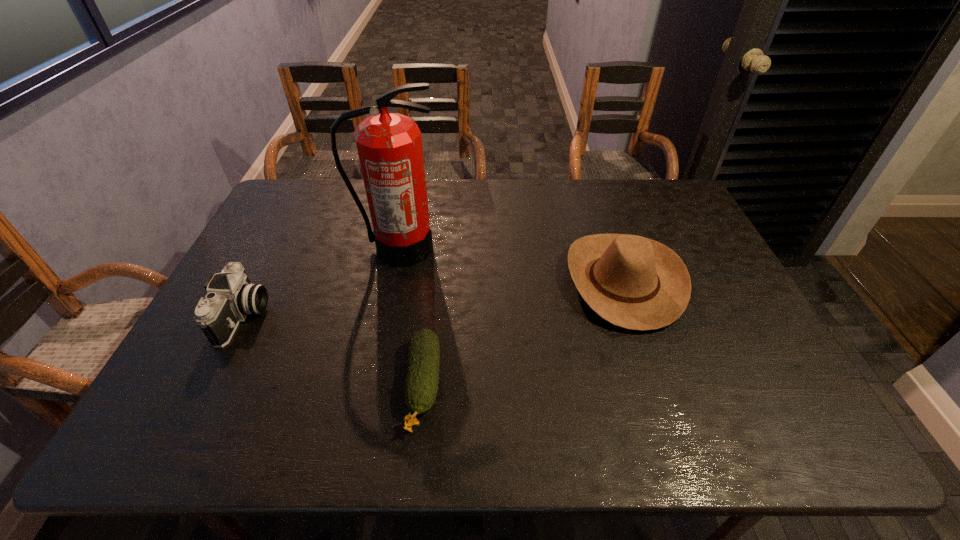
At what (x,y) coordinates should I click in order to perform the action: click on object situated at the left edge. Please return your answer as a coordinate pair (x, y). Looking at the image, I should click on (231, 296).

Locate an element on the screen. The height and width of the screenshot is (540, 960). object positioned at the right edge is located at coordinates (633, 282).

Locate an element on the screen. Image resolution: width=960 pixels, height=540 pixels. free space at the far edge of the desktop is located at coordinates (619, 186).

Where is `free space at the near edge of the desktop`? The width and height of the screenshot is (960, 540). free space at the near edge of the desktop is located at coordinates (468, 416).

Locate an element on the screen. vacant space at the left edge of the desktop is located at coordinates (266, 314).

Where is `vacant area at the right edge of the desktop`? vacant area at the right edge of the desktop is located at coordinates (739, 372).

Where is `vacant region at the far left corner of the desktop`? Image resolution: width=960 pixels, height=540 pixels. vacant region at the far left corner of the desktop is located at coordinates (296, 210).

At what (x,y) coordinates should I click in order to perform the action: click on free space at the far right corner of the desktop. Please return your answer as a coordinate pair (x, y). Looking at the image, I should click on (667, 213).

Where is `empty space between the rightmost object and the leftmost object`? This screenshot has height=540, width=960. empty space between the rightmost object and the leftmost object is located at coordinates (433, 299).

Where is `vacant area between the cowboy hat and the cucumber`? This screenshot has width=960, height=540. vacant area between the cowboy hat and the cucumber is located at coordinates (523, 333).